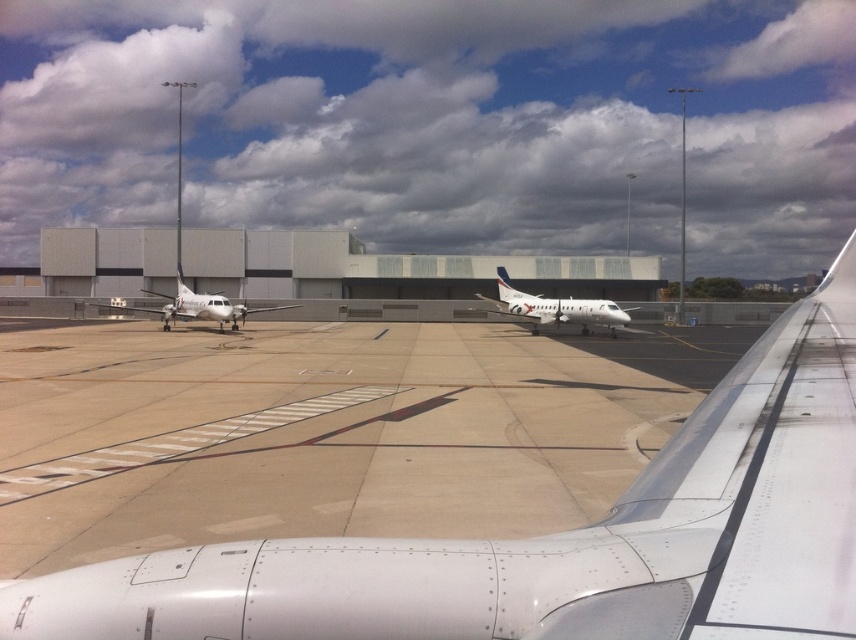
Does white metallic airplane at center appear on the right side of white matte airplane at left?

Indeed, white metallic airplane at center is positioned on the right side of white matte airplane at left.

Can you confirm if white metallic airplane at center is bigger than white matte airplane at left?

Incorrect, white metallic airplane at center is not larger than white matte airplane at left.

Identify the location of white metallic airplane at center. This screenshot has height=640, width=856. (556, 538).

Can you confirm if white metallic airplane at center is wider than white glossy airplane window at center?

Indeed, white metallic airplane at center has a greater width compared to white glossy airplane window at center.

This screenshot has width=856, height=640. What are the coordinates of `white metallic airplane at center` in the screenshot? It's located at (556, 538).

Can you confirm if silver metallic airplane at center is positioned to the right of white matte airplane at left?

Indeed, silver metallic airplane at center is positioned on the right side of white matte airplane at left.

Is silver metallic airplane at center thinner than white matte airplane at left?

Yes, silver metallic airplane at center is thinner than white matte airplane at left.

Measure the distance between point (492, 301) and camera.

A distance of 128.37 feet exists between point (492, 301) and camera.

Find the location of a particular element. The width and height of the screenshot is (856, 640). silver metallic airplane at center is located at coordinates (556, 307).